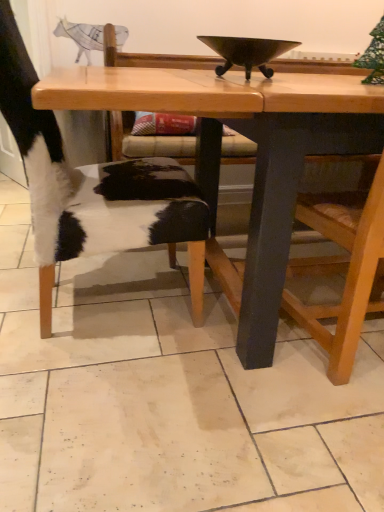
The height and width of the screenshot is (512, 384). I want to click on vacant space situated on the left part of wooden chair at right, so click(241, 364).